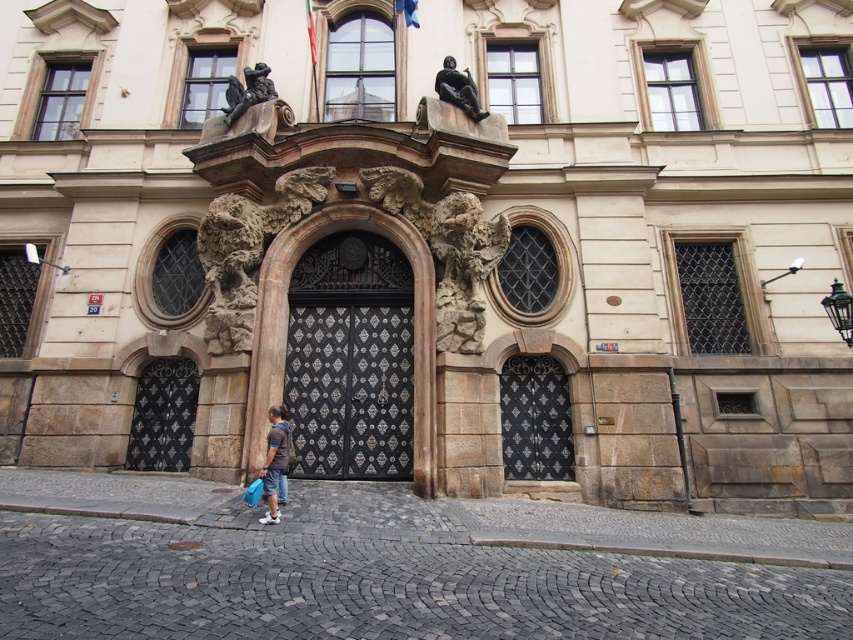
Consider the image. You are a photographer standing in front of the grand building. You notice the dark blue shirt at center and the dark gray stone statue at upper center. Which object would appear narrower when viewed from your current position?

The dark blue shirt at center is thinner than the dark gray stone statue at upper center, so it would appear narrower when viewed from your current position.